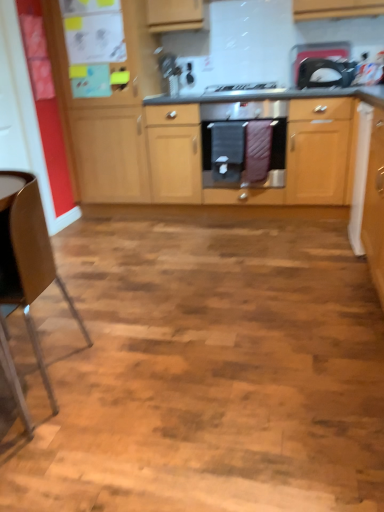
The width and height of the screenshot is (384, 512). What do you see at coordinates (241, 139) in the screenshot? I see `black fabric oven mitts at center` at bounding box center [241, 139].

Locate an element on the screen. This screenshot has width=384, height=512. wooden cabinets at center is located at coordinates (319, 147).

What are the coordinates of `brown leather chair at left` in the screenshot? It's located at (28, 258).

The image size is (384, 512). I want to click on white glossy microwave at upper right, so click(x=325, y=73).

The height and width of the screenshot is (512, 384). Identify the location of black matte gas stove at center. (242, 89).

Is wooden cabinets at center not near brown leather chair at left?

Yes, wooden cabinets at center and brown leather chair at left are quite far apart.

Looking at this image, which point is more forward, (180, 191) or (15, 261)?

The point (15, 261) is closer to the camera.

Looking at this image, is wooden cabinets at center in front of or behind brown leather chair at left in the image?

In the image, wooden cabinets at center appears behind brown leather chair at left.

The height and width of the screenshot is (512, 384). What are the coordinates of `cabinetry above the brown leather chair at left (from the image's perspective)` in the screenshot? It's located at (319, 147).

Can you tell me how much black fabric oven mitts at center and wooden cabinets at center differ in facing direction?

The angular difference between black fabric oven mitts at center and wooden cabinets at center is 0.248 degrees.

Can we say black fabric oven mitts at center lies outside wooden cabinets at center?

No, most part of black fabric oven mitts at center lies within wooden cabinets at center.

Who is smaller, black fabric oven mitts at center or wooden cabinets at center?

black fabric oven mitts at center is smaller.

Could you tell me if black fabric oven mitts at center is facing wooden cabinets at center?

Yes, black fabric oven mitts at center is facing wooden cabinets at center.

Is wooden cabinets at center wider than white glossy microwave at upper right?

Yes.

Considering their positions, is wooden cabinets at center located in front of or behind white glossy microwave at upper right?

Clearly, wooden cabinets at center is in front of white glossy microwave at upper right.

From a real-world perspective, who is located higher, wooden cabinets at center or white glossy microwave at upper right?

white glossy microwave at upper right.

From their relative heights in the image, would you say wooden cabinets at center is taller or shorter than white glossy microwave at upper right?

In the image, wooden cabinets at center appears to be taller than white glossy microwave at upper right.

Consider the image. Does black matte gas stove at center appear on the right side of brown leather chair at left?

Correct, you'll find black matte gas stove at center to the right of brown leather chair at left.

Is black matte gas stove at center thinner than brown leather chair at left?

Indeed, black matte gas stove at center has a lesser width compared to brown leather chair at left.

Is black matte gas stove at center bigger than brown leather chair at left?

Incorrect, black matte gas stove at center is not larger than brown leather chair at left.

Who is taller, black matte gas stove at center or brown leather chair at left?

brown leather chair at left.

Considering the sizes of objects black matte gas stove at center and black fabric oven mitts at center in the image provided, who is smaller, black matte gas stove at center or black fabric oven mitts at center?

black matte gas stove at center.

Which is behind, black matte gas stove at center or black fabric oven mitts at center?

black matte gas stove at center is further away from the camera.

Is black matte gas stove at center placed right next to black fabric oven mitts at center?

black matte gas stove at center and black fabric oven mitts at center are not in contact.

You are a GUI agent. You are given a task and a screenshot of the screen. Output one action in this format:
    pyautogui.click(x=<x>, y=<y>)
    Task: Click on the gas stove behind the black fabric oven mitts at center
    This screenshot has height=512, width=384.
    Given the screenshot: What is the action you would take?
    pyautogui.click(x=242, y=89)

Is wooden cabinets at center not inside black matte gas stove at center?

wooden cabinets at center lies outside black matte gas stove at center's area.

Is point (137, 121) positioned after point (219, 90)?

No.

Can you see wooden cabinets at center touching black matte gas stove at center?

No, wooden cabinets at center is not in contact with black matte gas stove at center.

Considering the sizes of black matte gas stove at center and wooden cabinets at center in the image, is black matte gas stove at center bigger or smaller than wooden cabinets at center?

Clearly, black matte gas stove at center is smaller in size than wooden cabinets at center.

Does point (266, 88) appear closer or farther from the camera than point (79, 148)?

Point (266, 88) is closer to the camera than point (79, 148).

Which object is closer to the camera taking this photo, black matte gas stove at center or wooden cabinets at center?

wooden cabinets at center is closer to the camera.

Would you consider black matte gas stove at center to be distant from wooden cabinets at center?

No, black matte gas stove at center is not far away from wooden cabinets at center.

The image size is (384, 512). Find the location of `cabinetry that is above the brown leather chair at left (from the image's perspective)`. cabinetry that is above the brown leather chair at left (from the image's perspective) is located at coordinates (319, 147).

I want to click on cabinetry below the black fabric oven mitts at center (from the image's perspective), so click(319, 147).

Which object lies nearer to the anchor point brown leather chair at left, black matte gas stove at center or white glossy microwave at upper right?

black matte gas stove at center.

Looking at the image, which one is located closer to black fabric oven mitts at center, white glossy microwave at upper right or wooden cabinets at center?

Based on the image, wooden cabinets at center appears to be nearer to black fabric oven mitts at center.

Estimate the real-world distances between objects in this image. Which object is further from brown leather chair at left, black matte gas stove at center or wooden cabinets at center?

Based on the image, black matte gas stove at center appears to be further to brown leather chair at left.

Based on their spatial positions, is white glossy microwave at upper right or brown leather chair at left further from black fabric oven mitts at center?

brown leather chair at left.

Looking at the image, which one is located further to brown leather chair at left, black fabric oven mitts at center or black matte gas stove at center?

Based on the image, black matte gas stove at center appears to be further to brown leather chair at left.

From the image, which object appears to be nearer to black fabric oven mitts at center, black matte gas stove at center or wooden cabinets at center?

Based on the image, wooden cabinets at center appears to be nearer to black fabric oven mitts at center.

Which object lies further to the anchor point black matte gas stove at center, black fabric oven mitts at center or white glossy microwave at upper right?

white glossy microwave at upper right lies further to black matte gas stove at center than the other object.

Considering their positions, is white glossy microwave at upper right positioned further to brown leather chair at left than wooden cabinets at center?

Result: The object further to brown leather chair at left is white glossy microwave at upper right.

Where is `kitchen appliance between brown leather chair at left and black fabric oven mitts at center from front to back`? kitchen appliance between brown leather chair at left and black fabric oven mitts at center from front to back is located at coordinates (325, 73).

I want to click on home appliance between black matte gas stove at center and wooden cabinets at center vertically, so click(x=241, y=139).

Locate an element on the screen. This screenshot has height=512, width=384. cabinetry between brown leather chair at left and black fabric oven mitts at center from front to back is located at coordinates pos(319,147).

Locate an element on the screen. cabinetry between brown leather chair at left and black matte gas stove at center from front to back is located at coordinates (319, 147).